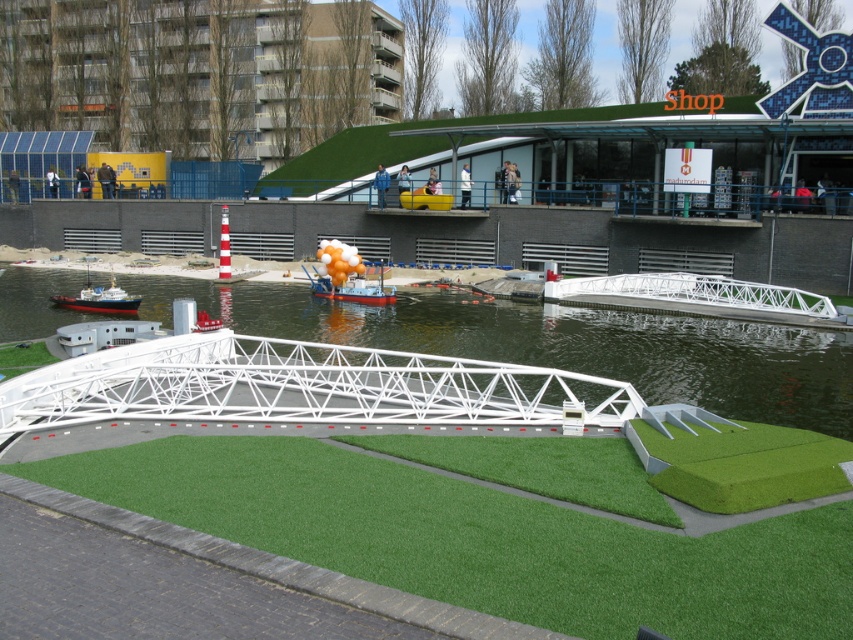
Question: Which point appears farthest from the camera in this image?

Choices:
 (A) (112, 292)
 (B) (328, 275)
 (C) (393, 349)

Answer: (B)

Question: From the image, what is the correct spatial relationship of green artificial turf at center in relation to white plastic water at center?

Choices:
 (A) above
 (B) below

Answer: (B)

Question: Can you confirm if green artificial turf at center is positioned above orange glossy boat at center?

Choices:
 (A) yes
 (B) no

Answer: (B)

Question: Estimate the real-world distances between objects in this image. Which object is farther from the red and white plastic boat at left?

Choices:
 (A) green artificial turf at center
 (B) orange glossy boat at center

Answer: (A)

Question: Is orange glossy boat at center to the left of red and white plastic boat at left from the viewer's perspective?

Choices:
 (A) yes
 (B) no

Answer: (B)

Question: Which of these objects is positioned closest to the red and white plastic boat at left?

Choices:
 (A) white plastic water at center
 (B) green artificial turf at center
 (C) orange glossy boat at center

Answer: (C)